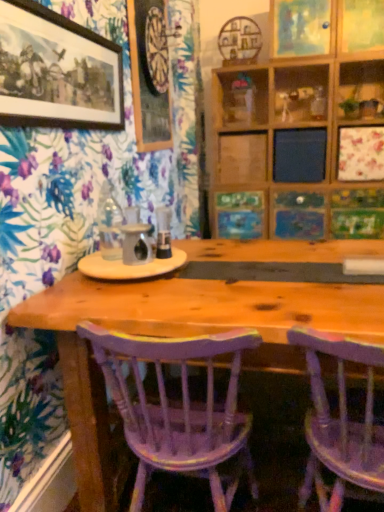
This screenshot has width=384, height=512. I want to click on free space above purple painted wood chair at center, arranged as the first chair when viewed from the left (from a real-world perspective), so click(x=172, y=306).